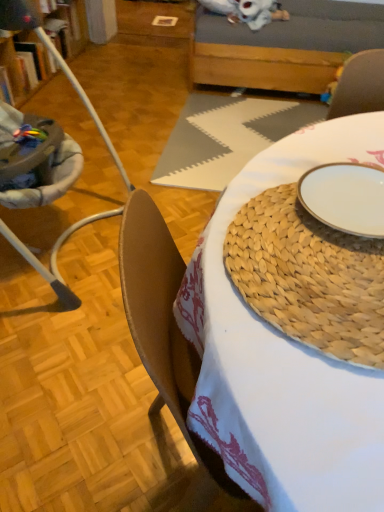
What do you see at coordinates (345, 197) in the screenshot? I see `white ceramic plate at center` at bounding box center [345, 197].

Identify the location of woven mat at center. The image size is (384, 512). (284, 359).

The width and height of the screenshot is (384, 512). Describe the element at coordinates (226, 137) in the screenshot. I see `white woven placemat at center` at that location.

Where is `natural woven placemat at center`? natural woven placemat at center is located at coordinates (309, 277).

Consider the image. Can you confirm if velvet-like gray armchair at upper right is thinner than white ceramic plate at center?

Yes, velvet-like gray armchair at upper right is thinner than white ceramic plate at center.

Does point (368, 102) come in front of point (324, 200)?

No, it is behind (324, 200).

Is white ceramic plate at center at the back of velvet-like gray armchair at upper right?

No, velvet-like gray armchair at upper right's orientation is not away from white ceramic plate at center.

From a real-world perspective, which is physically above, velvet-like gray armchair at upper right or white ceramic plate at center?

white ceramic plate at center.

I want to click on armchair behind the white ceramic plate at center, so click(x=359, y=85).

Does white ceramic plate at center have a smaller size compared to velvet-like gray armchair at upper right?

Indeed, white ceramic plate at center has a smaller size compared to velvet-like gray armchair at upper right.

Is white ceramic plate at center wider than velvet-like gray armchair at upper right?

Yes.

From the image's perspective, which object appears higher, wooden couch at upper center or velvet-like gray armchair at upper right?

wooden couch at upper center appears higher in the image.

Between wooden couch at upper center and velvet-like gray armchair at upper right, which one has less height?

velvet-like gray armchair at upper right is shorter.

Is point (274, 59) closer to viewer compared to point (357, 75)?

No, it is not.

Where is `tablecloth on the right of natural woven placemat at center`? The height and width of the screenshot is (512, 384). tablecloth on the right of natural woven placemat at center is located at coordinates (226, 137).

Considering the sizes of objects white woven placemat at center and natural woven placemat at center in the image provided, who is shorter, white woven placemat at center or natural woven placemat at center?

Standing shorter between the two is natural woven placemat at center.

Based on the photo, what's the angular difference between white woven placemat at center and natural woven placemat at center's facing directions?

The angular difference between white woven placemat at center and natural woven placemat at center is 7.25 degrees.

Considering their positions, is white woven placemat at center located in front of or behind natural woven placemat at center?

Clearly, white woven placemat at center is behind natural woven placemat at center.

Can you tell me how much white woven placemat at center and velvet-like gray armchair at upper right differ in facing direction?

There is a 178-degree angle between the facing directions of white woven placemat at center and velvet-like gray armchair at upper right.

Is white woven placemat at center looking in the opposite direction of velvet-like gray armchair at upper right?

No, white woven placemat at center's orientation is not away from velvet-like gray armchair at upper right.

In the image, is white woven placemat at center on the left side or the right side of velvet-like gray armchair at upper right?

Clearly, white woven placemat at center is on the left of velvet-like gray armchair at upper right in the image.

Considering the sizes of white woven placemat at center and velvet-like gray armchair at upper right in the image, is white woven placemat at center bigger or smaller than velvet-like gray armchair at upper right?

white woven placemat at center is bigger than velvet-like gray armchair at upper right.

Based on the photo, in terms of height, does brown leather chair at left look taller or shorter compared to velvet-like gray armchair at upper right?

brown leather chair at left is taller than velvet-like gray armchair at upper right.

Identify the location of armchair on the right of brown leather chair at left. The width and height of the screenshot is (384, 512). (359, 85).

Which object is positioned more to the left, brown leather chair at left or velvet-like gray armchair at upper right?

brown leather chair at left.

Would you consider brown leather chair at left to be distant from velvet-like gray armchair at upper right?

brown leather chair at left is actually quite close to velvet-like gray armchair at upper right.

Based on the photo, based on their positions, is wooden couch at upper center located to the left or right of brown leather chair at left?

In the image, wooden couch at upper center appears on the right side of brown leather chair at left.

Can we say wooden couch at upper center lies outside brown leather chair at left?

Indeed, wooden couch at upper center is completely outside brown leather chair at left.

Which of these two, wooden couch at upper center or brown leather chair at left, is thinner?

Thinner between the two is brown leather chair at left.

Where is `plate located on the left of velvet-like gray armchair at upper right`? Image resolution: width=384 pixels, height=512 pixels. plate located on the left of velvet-like gray armchair at upper right is located at coordinates (345, 197).

Locate an element on the screen. This screenshot has height=512, width=384. armchair behind the white ceramic plate at center is located at coordinates (359, 85).

From the image, which object appears to be nearer to white ceramic plate at center, natural woven placemat at center or velvet-like gray armchair at upper right?

Based on the image, natural woven placemat at center appears to be nearer to white ceramic plate at center.

From the image, which object appears to be nearer to velvet-like gray armchair at upper right, white ceramic plate at center or woven mat at center?

white ceramic plate at center.

Which object lies further to the anchor point white woven placemat at center, brown leather chair at left or natural woven placemat at center?

natural woven placemat at center is positioned further to the anchor white woven placemat at center.

Considering their positions, is wooden couch at upper center positioned closer to velvet-like gray armchair at upper right than natural woven placemat at center?

The object closer to velvet-like gray armchair at upper right is natural woven placemat at center.

From the image, which object appears to be farther from natural woven placemat at center, velvet-like gray armchair at upper right or white woven placemat at center?

Result: white woven placemat at center is positioned further to the anchor natural woven placemat at center.

Estimate the real-world distances between objects in this image. Which object is further from white woven placemat at center, wooden couch at upper center or woven mat at center?

The object further to white woven placemat at center is woven mat at center.

Considering their positions, is woven mat at center positioned further to natural woven placemat at center than white ceramic plate at center?

The object further to natural woven placemat at center is white ceramic plate at center.

When comparing their distances from natural woven placemat at center, does white ceramic plate at center or velvet-like gray armchair at upper right seem further?

velvet-like gray armchair at upper right.

Locate an element on the screen. The width and height of the screenshot is (384, 512). couch positioned between brown leather chair at left and velvet-like gray armchair at upper right from near to far is located at coordinates (284, 46).

I want to click on platter positioned between woven mat at center and velvet-like gray armchair at upper right from near to far, so click(309, 277).

What are the coordinates of `couch positioned between natural woven placemat at center and velvet-like gray armchair at upper right from near to far` in the screenshot? It's located at (284, 46).

Where is `chair between natural woven placemat at center and velvet-like gray armchair at upper right from front to back`? The image size is (384, 512). chair between natural woven placemat at center and velvet-like gray armchair at upper right from front to back is located at coordinates (34, 160).